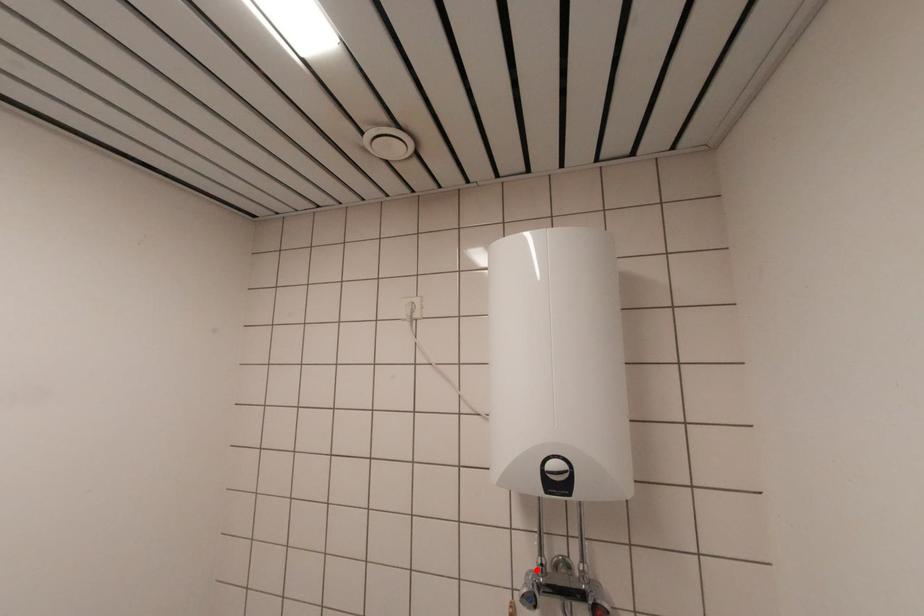
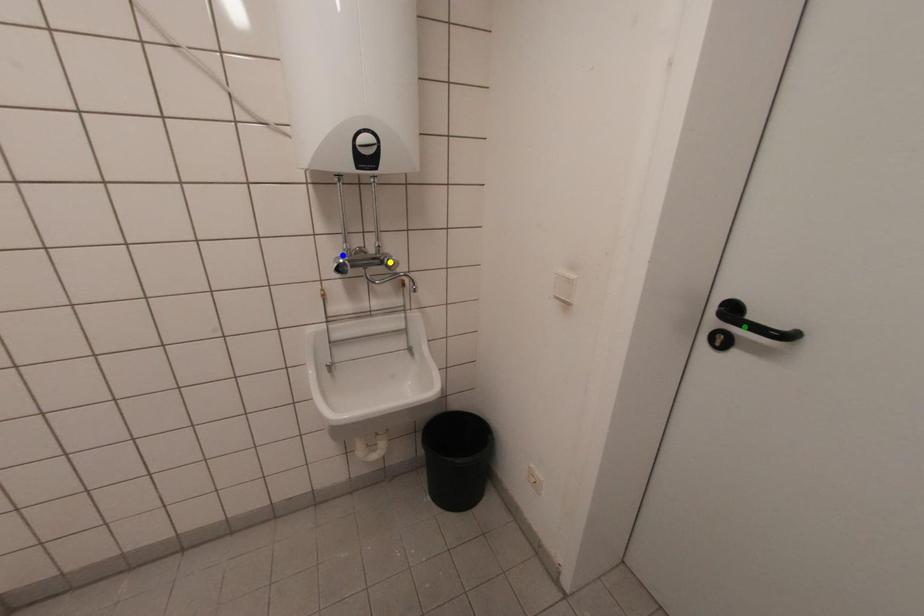
Question: I am providing you with two images of the same scene from different viewpoints. A red point is marked on the first image. You are given multiple points on the second image. Which point in image 2 is actually the same real-world point as the red point in image 1?

Choices:
 (A) green point
 (B) blue point
 (C) yellow point

Answer: (B)